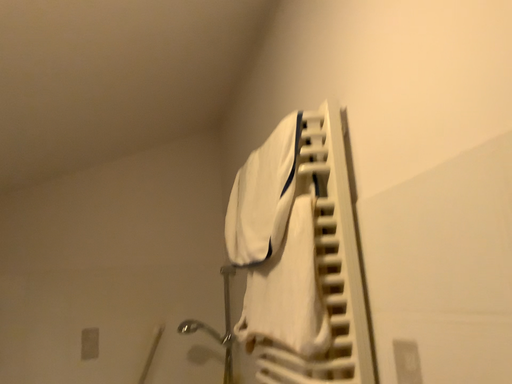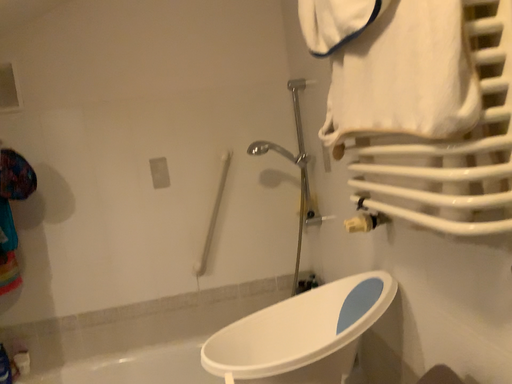
Question: How did the camera likely rotate when shooting the video?

Choices:
 (A) rotated downward
 (B) rotated upward

Answer: (A)